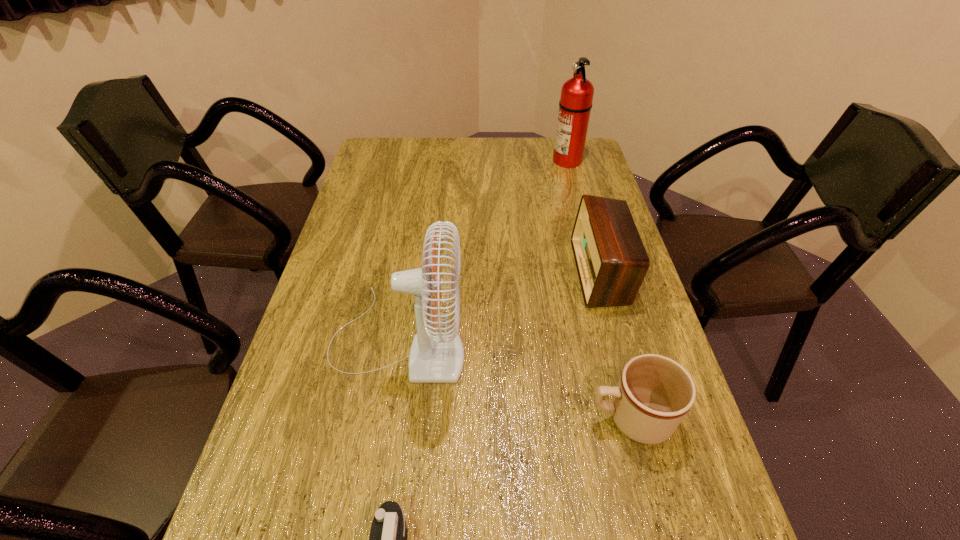
Find the location of `vacant space at the far edge`. vacant space at the far edge is located at coordinates (406, 167).

Where is `free spot at the left edge of the desktop`? The image size is (960, 540). free spot at the left edge of the desktop is located at coordinates (332, 352).

At what (x,y) coordinates should I click in order to perform the action: click on vacant space at the far left corner of the desktop. Please return your answer as a coordinate pair (x, y). Looking at the image, I should click on pos(369,166).

This screenshot has height=540, width=960. In order to click on vacant space that's between the radio receiver and the fan in this screenshot , I will do `click(499, 306)`.

The height and width of the screenshot is (540, 960). Find the location of `free point between the mug and the fan`. free point between the mug and the fan is located at coordinates (515, 379).

The image size is (960, 540). I want to click on vacant region between the mug and the fan, so click(x=515, y=379).

The height and width of the screenshot is (540, 960). Identify the location of the second closest object to the third shortest object. (435, 357).

Find the location of a particular element. the fourth closest object to the radio receiver is located at coordinates (388, 539).

What are the coordinates of `free space in the image that satisfies the following two spatial constraints: 1. on the side of the mug with the handle; 2. on the front-facing side of the fan` in the screenshot? It's located at (611, 340).